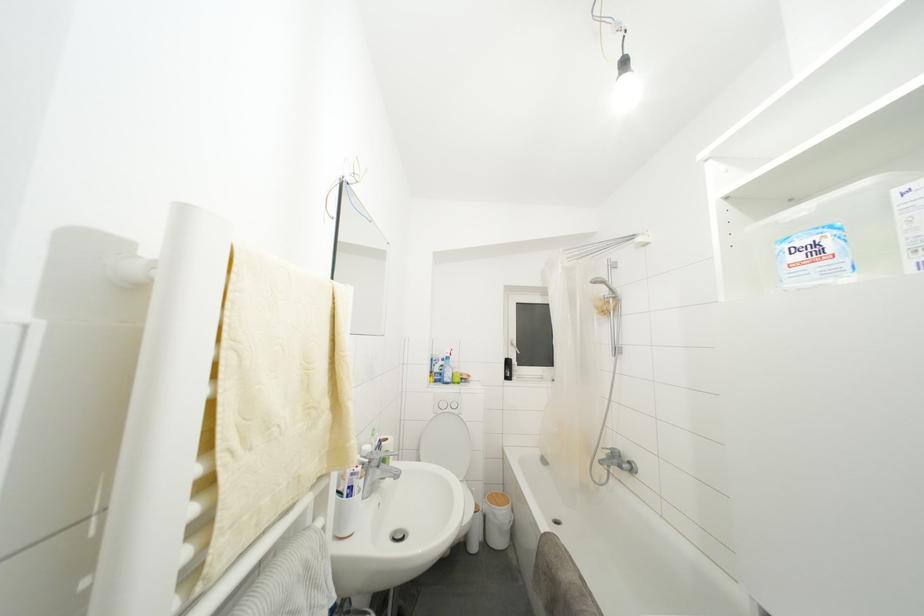
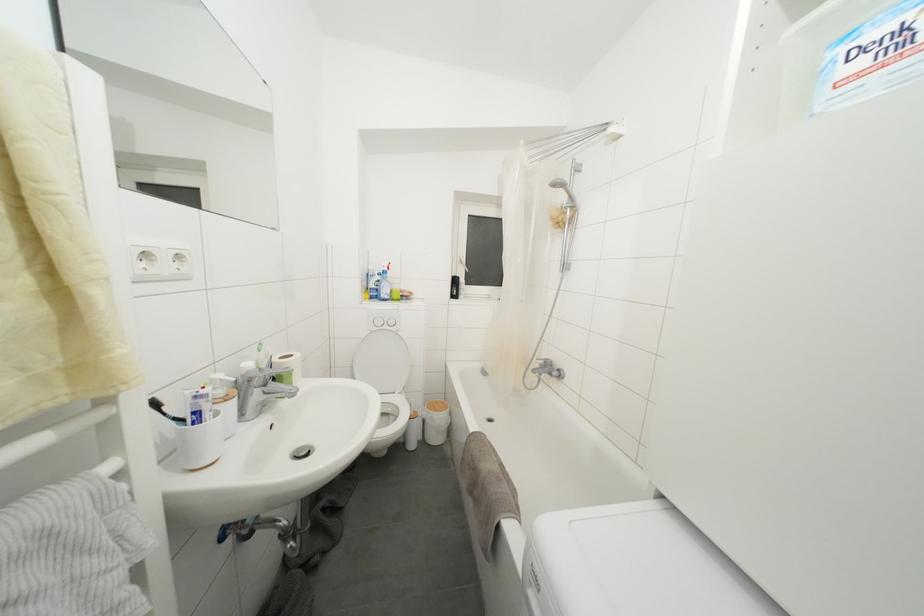
Where in the second image is the point corresponding to (497,503) from the first image?

(438, 411)